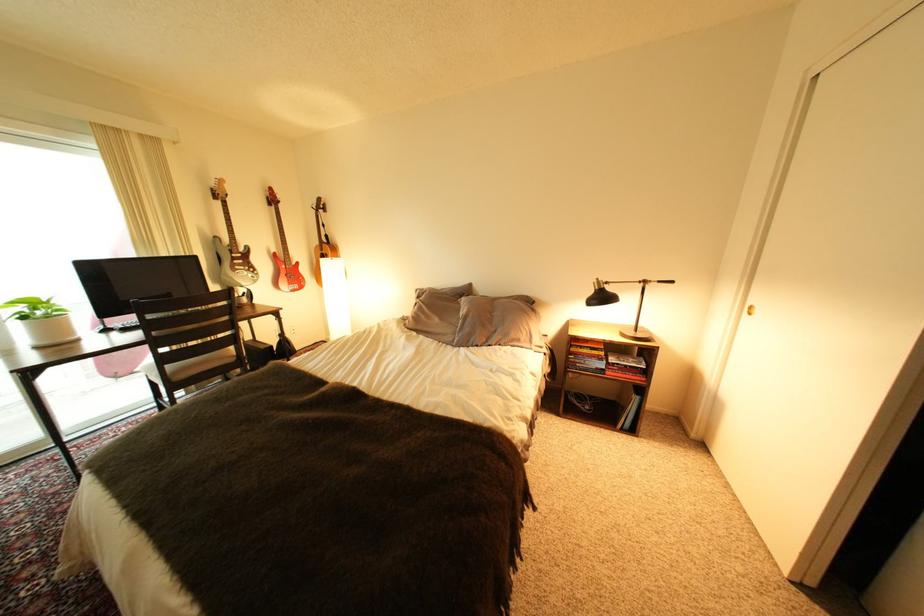
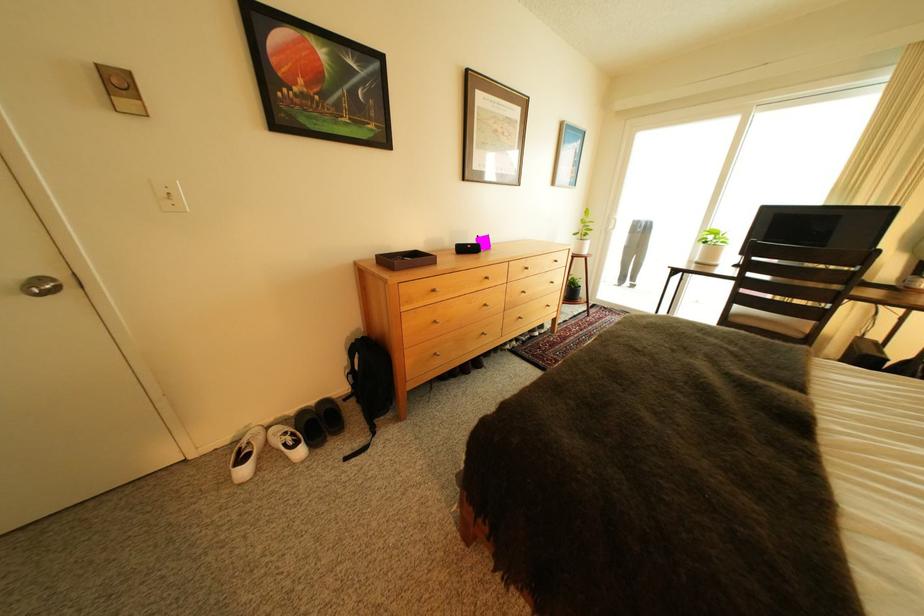
In the second image, find the point that corresponds to (37,318) in the first image.

(718, 244)